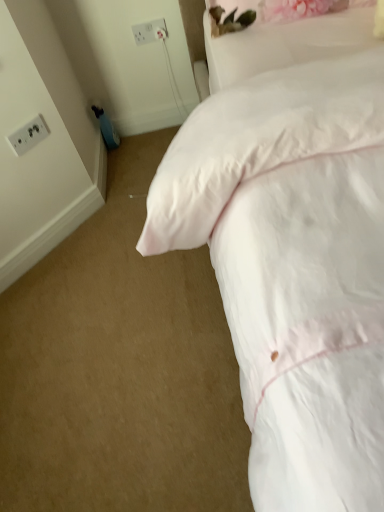
Question: Would you say white plastic socket at upper left, which is counted as the 2th electric outlet, starting from the left, is to the left or to the right of white soft bed at upper right in the picture?

Choices:
 (A) right
 (B) left

Answer: (B)

Question: In terms of height, does white plastic socket at upper left, arranged as the 2th electric outlet when viewed from the front, look taller or shorter compared to white soft bed at upper right?

Choices:
 (A) short
 (B) tall

Answer: (A)

Question: Which of these objects is positioned closest to the white satin pillow at upper right?

Choices:
 (A) white plastic socket at upper left, which is counted as the 2th electric outlet, starting from the left
 (B) white soft bed at upper right
 (C) white plastic electrical outlet at upper left, which is the second electric outlet in top-to-bottom order

Answer: (B)

Question: Which of these objects is positioned farthest from the white soft bed at upper right?

Choices:
 (A) white plastic socket at upper left, arranged as the 2th electric outlet when viewed from the front
 (B) white satin pillow at upper right
 (C) white plastic electrical outlet at upper left, which is the second electric outlet in top-to-bottom order

Answer: (A)